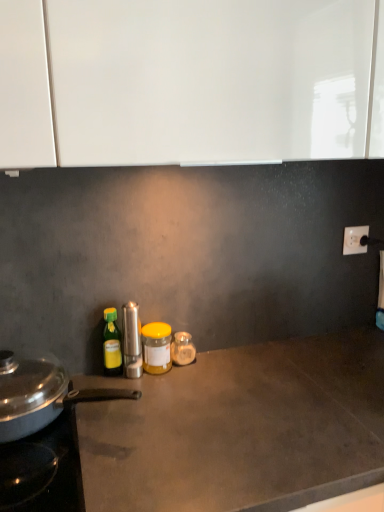
This screenshot has height=512, width=384. I want to click on free space between metallic silver pan at left, which appears as the first kitchen appliance when viewed from the left, and translucent glass jar at center, marked as the first bottle in a right-to-left arrangement, so click(162, 396).